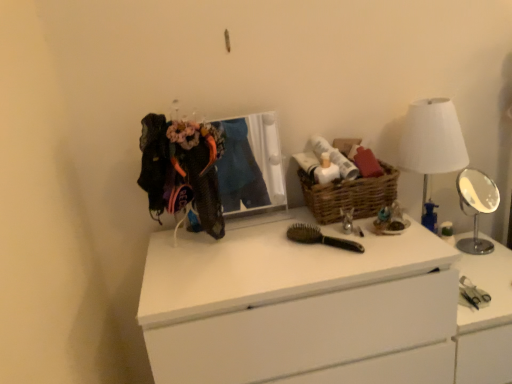
Locate an element on the screen. The width and height of the screenshot is (512, 384). free spot to the right of black wooden hairbrush at center is located at coordinates (381, 243).